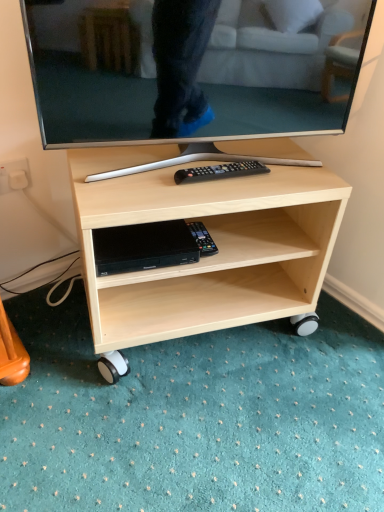
Locate an element on the screen. free space above light wood/texture tv stand at center (from a real-world perspective) is located at coordinates (203, 163).